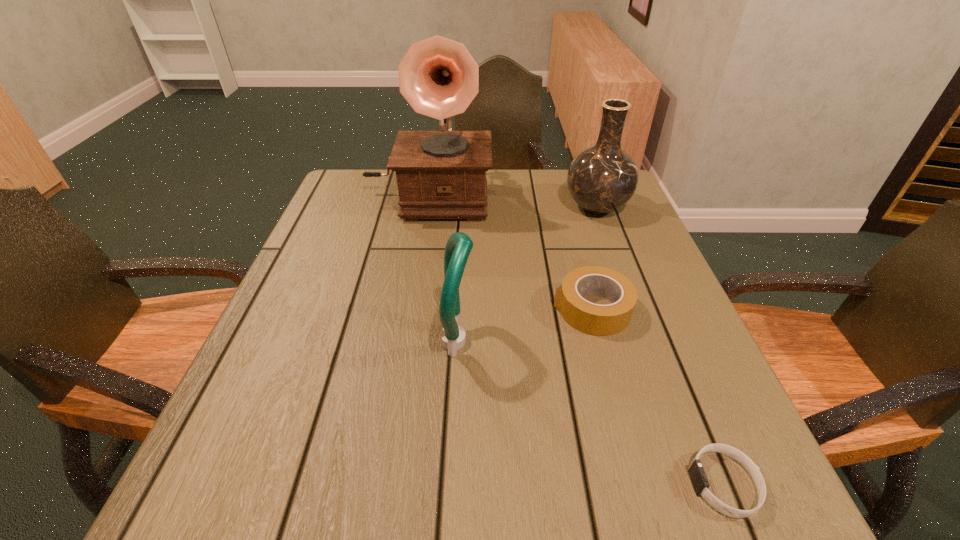
Where is `the third closest object to the tallest object`? Image resolution: width=960 pixels, height=540 pixels. the third closest object to the tallest object is located at coordinates (459, 245).

Find the location of a particular element. This screenshot has height=540, width=960. object identified as the fourth closest to the bottle opener is located at coordinates tap(601, 179).